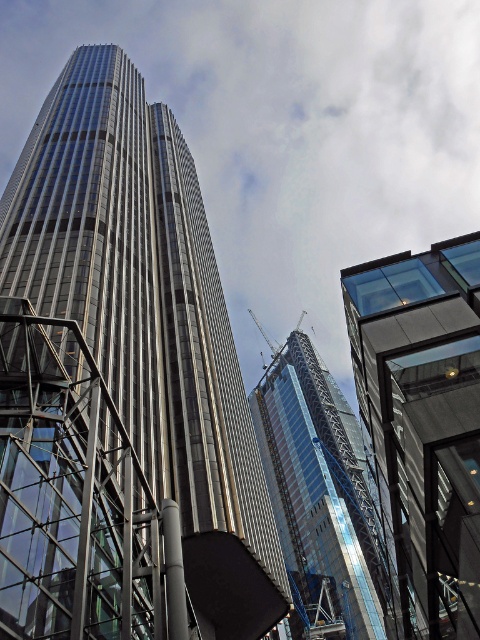
Question: Among these objects, which one is nearest to the camera?

Choices:
 (A) glassy steel skyscraper at center
 (B) glassy metallic skyscraper at center
 (C) glassy reflective building at right

Answer: (C)

Question: Is glassy reflective building at right positioned at the back of glassy steel skyscraper at center?

Choices:
 (A) no
 (B) yes

Answer: (A)

Question: Which object is the closest to the glassy steel skyscraper at center?

Choices:
 (A) glassy reflective building at right
 (B) glassy metallic skyscraper at center

Answer: (B)

Question: Observing the image, what is the correct spatial positioning of glassy reflective building at right in reference to glassy steel skyscraper at center?

Choices:
 (A) above
 (B) below

Answer: (A)

Question: Which point is closer to the camera?

Choices:
 (A) glassy steel skyscraper at center
 (B) glassy metallic skyscraper at center
 (C) glassy reflective building at right

Answer: (C)

Question: Is glassy metallic skyscraper at center bigger than glassy reflective building at right?

Choices:
 (A) yes
 (B) no

Answer: (A)